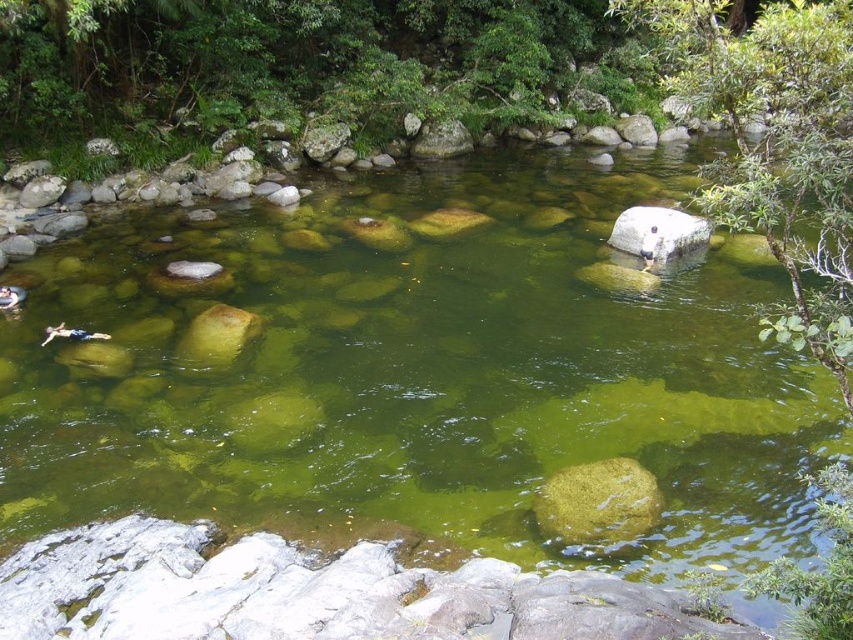
Between green mossy rock at center and white smooth rock at center, which one has less height?

green mossy rock at center

Does green mossy rock at center have a lesser width compared to white smooth rock at center?

Yes.

The image size is (853, 640). What do you see at coordinates (598, 500) in the screenshot?
I see `green mossy rock at center` at bounding box center [598, 500].

The height and width of the screenshot is (640, 853). What are the coordinates of `green mossy rock at center` in the screenshot? It's located at (598, 500).

Is brown smooth rock at center smaller than smooth gray rock at center?

Indeed, brown smooth rock at center has a smaller size compared to smooth gray rock at center.

Measure the distance between brown smooth rock at center and camera.

A distance of 6.97 meters exists between brown smooth rock at center and camera.

Between point (234, 333) and point (421, 150), which one is positioned behind?

The point (421, 150) is behind.

Where is `brown smooth rock at center`? brown smooth rock at center is located at coordinates (216, 336).

Does point (550, 531) come closer to viewer compared to point (202, 321)?

Yes, point (550, 531) is in front of point (202, 321).

Between point (550, 529) and point (235, 332), which one is positioned behind?

Positioned behind is point (235, 332).

Find the location of a particular element. Image resolution: width=853 pixels, height=640 pixels. green mossy rock at center is located at coordinates (598, 500).